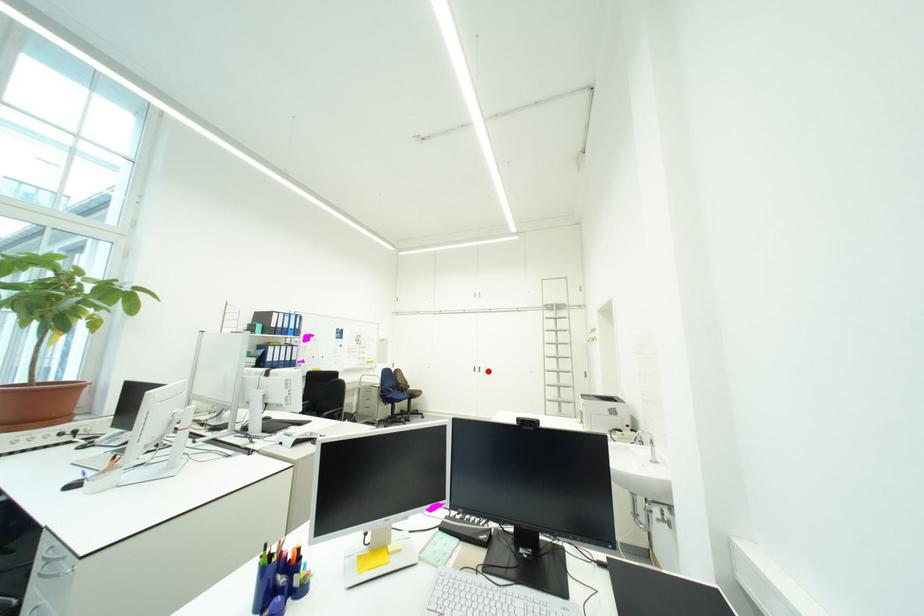
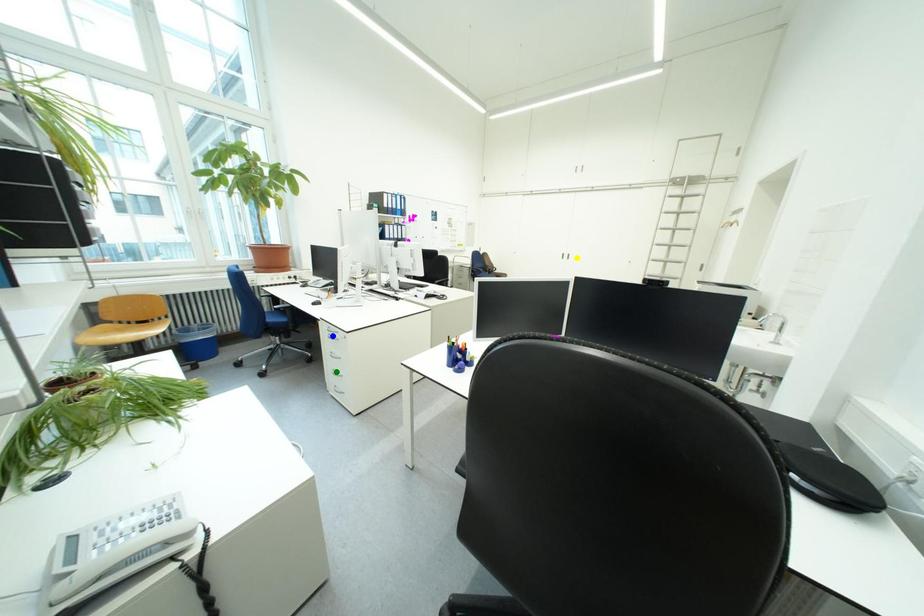
Question: I am providing you with two images of the same scene from different viewpoints. A red point is marked on the first image. You are given multiple points on the second image. Can you choose the point in image 2 that corresponds to the point in image 1?

Choices:
 (A) green point
 (B) blue point
 (C) yellow point

Answer: (C)